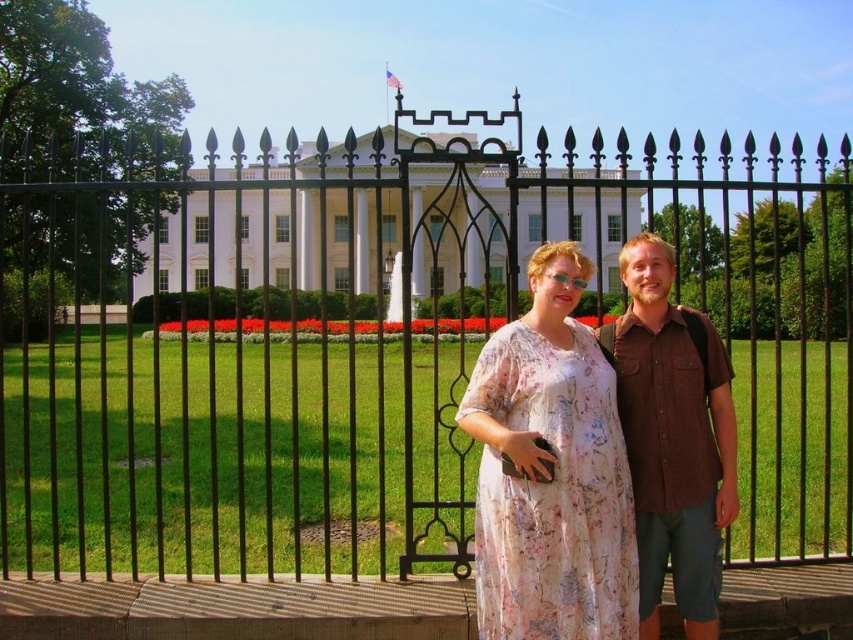
You are standing at the point marked by the coordinates (379,340). Based on the scene description, what object are you most likely standing in front of?

The point marked by the coordinates (379,340) indicates the location of the black wrought iron gate at center, so you are most likely standing in front of the black wrought iron gate at center.

You are a photographer trying to capture a clear shot of the White House through the black wrought iron gate at center and the brown cotton shirt at center. Which object is taller and might block your view?

The black wrought iron gate at center is taller than the brown cotton shirt at center, so it might block your view more than the brown cotton shirt at center.